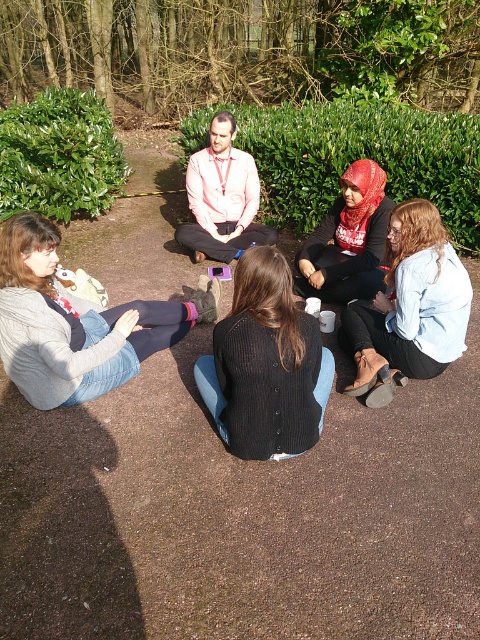
Can you confirm if black ribbed sweater at center is bigger than light blue denim jacket at lower right?

Yes.

Can you confirm if black ribbed sweater at center is positioned to the left of light blue denim jacket at lower right?

Indeed, black ribbed sweater at center is positioned on the left side of light blue denim jacket at lower right.

Who is more forward, (232, 356) or (379, 332)?

Point (232, 356) is more forward.

Locate an element on the screen. This screenshot has height=640, width=480. black ribbed sweater at center is located at coordinates (265, 364).

Is the position of knitted grey sweater at lower left more distant than that of black ribbed sweater at center?

Yes, it is behind black ribbed sweater at center.

Who is more forward, (23, 292) or (324, 372)?

Point (23, 292) is in front.

What are the coordinates of `knitted grey sweater at lower left` in the screenshot? It's located at (75, 323).

Is light blue denim jacket at lower right bigger than matte red scarf at center?

No, light blue denim jacket at lower right is not bigger than matte red scarf at center.

Does point (439, 296) come behind point (308, 257)?

That is False.

Describe the element at coordinates (409, 307) in the screenshot. I see `light blue denim jacket at lower right` at that location.

You are a GUI agent. You are given a task and a screenshot of the screen. Output one action in this format:
    pyautogui.click(x=<x>, y=<y>)
    Task: Click on the light blue denim jacket at lower right
    
    Given the screenshot: What is the action you would take?
    pyautogui.click(x=409, y=307)